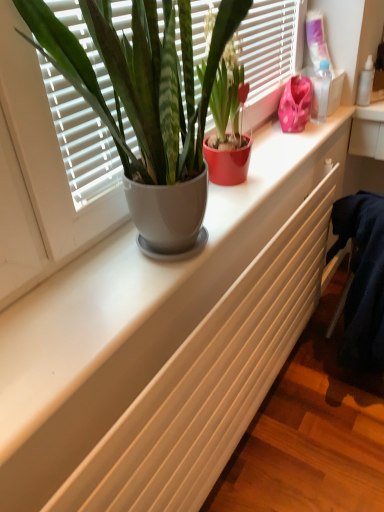
Question: Is pink fabric at upper right to the right of white matte radiator at center from the viewer's perspective?

Choices:
 (A) no
 (B) yes

Answer: (B)

Question: Is white matte radiator at center completely or partially inside pink fabric at upper right?

Choices:
 (A) yes
 (B) no

Answer: (B)

Question: Does pink fabric at upper right touch white matte radiator at center?

Choices:
 (A) yes
 (B) no

Answer: (B)

Question: Does pink fabric at upper right have a lesser height compared to white matte radiator at center?

Choices:
 (A) yes
 (B) no

Answer: (A)

Question: Is pink fabric at upper right outside white matte radiator at center?

Choices:
 (A) yes
 (B) no

Answer: (A)

Question: Is the position of pink fabric at upper right less distant than that of white matte radiator at center?

Choices:
 (A) yes
 (B) no

Answer: (B)

Question: Is matte white pot at upper left, which appears as the second houseplant when viewed from the right, facing towards white matte radiator at center?

Choices:
 (A) yes
 (B) no

Answer: (B)

Question: Considering the relative positions of matte white pot at upper left, arranged as the 1th houseplant when viewed from the left, and white matte radiator at center in the image provided, is matte white pot at upper left, arranged as the 1th houseplant when viewed from the left, in front of white matte radiator at center?

Choices:
 (A) no
 (B) yes

Answer: (A)

Question: Is matte white pot at upper left, which appears as the second houseplant when viewed from the right, facing away from white matte radiator at center?

Choices:
 (A) yes
 (B) no

Answer: (B)

Question: Is matte white pot at upper left, arranged as the 1th houseplant when viewed from the left, thinner than white matte radiator at center?

Choices:
 (A) yes
 (B) no

Answer: (A)

Question: Is matte white pot at upper left, which appears as the second houseplant when viewed from the right, positioned far away from white matte radiator at center?

Choices:
 (A) no
 (B) yes

Answer: (A)

Question: Does matte white pot at upper left, arranged as the 1th houseplant when viewed from the left, have a lesser height compared to white matte radiator at center?

Choices:
 (A) yes
 (B) no

Answer: (A)

Question: Is transparent plastic bottle at upper right, which is the 1th toiletry from front to back, far away from pink fabric at upper right?

Choices:
 (A) yes
 (B) no

Answer: (B)